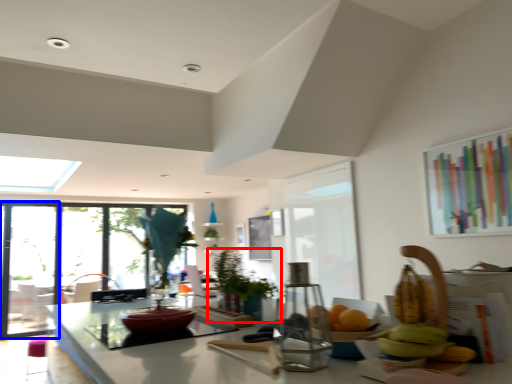
Question: Among these objects, which one is farthest to the camera, houseplant (highlighted by a red box) or screen door (highlighted by a blue box)?

Choices:
 (A) houseplant
 (B) screen door

Answer: (B)